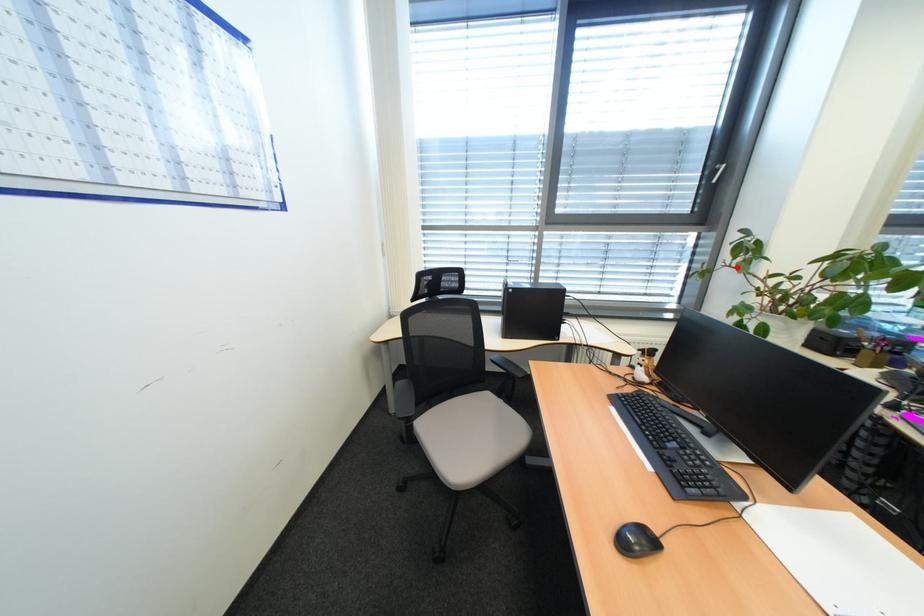
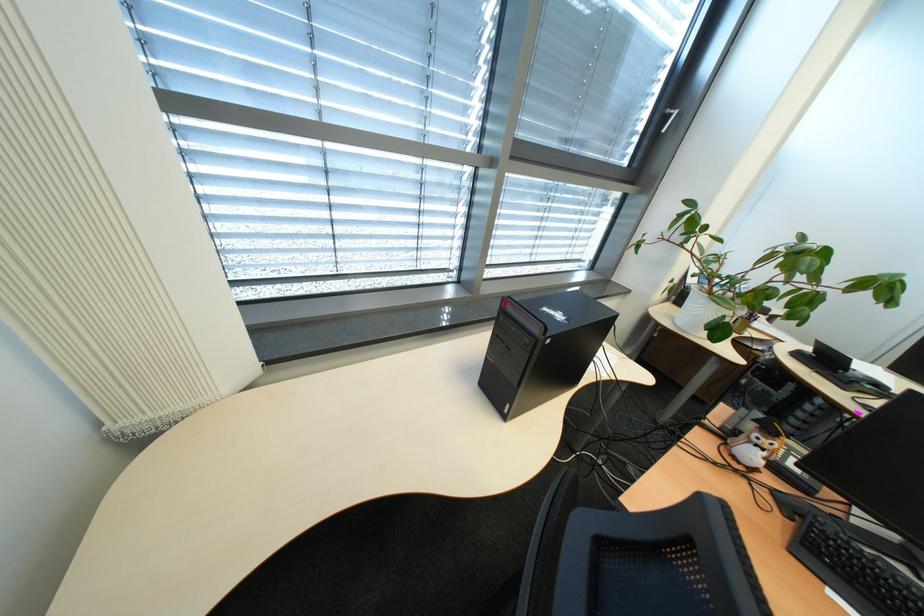
Find the pixel in the second image that matches the highlighted location in the first image.

(675, 241)